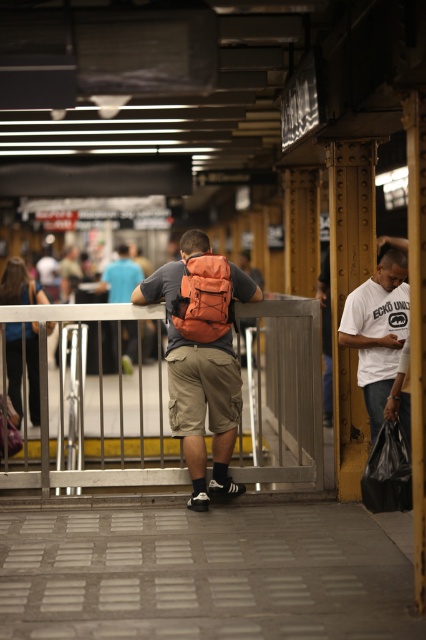
Is white cotton shirt at right positioned in front of matte orange backpack at center?

Yes, white cotton shirt at right is closer to the viewer.

Between point (348, 344) and point (104, 285), which one is positioned in front?

Positioned in front is point (348, 344).

Where is `white cotton shirt at right`? white cotton shirt at right is located at coordinates (377, 330).

Does metallic silver rail at center have a lesser width compared to white cotton shirt at right?

Yes.

Does metallic silver rail at center appear under white cotton shirt at right?

Correct, metallic silver rail at center is located below white cotton shirt at right.

Who is more forward, (x=97, y=465) or (x=402, y=328)?

Point (x=402, y=328) is in front.

At what (x,y) coordinates should I click in order to perform the action: click on metallic silver rail at center. Please return your answer as a coordinate pair (x, y). The width and height of the screenshot is (426, 640). Looking at the image, I should click on (98, 417).

This screenshot has width=426, height=640. In order to click on metallic silver rail at center in this screenshot , I will do `click(98, 417)`.

Between metallic silver rail at center and khaki cargo shorts at center, which one appears on the right side from the viewer's perspective?

khaki cargo shorts at center is more to the right.

Between point (115, 385) and point (180, 353), which one is positioned in front?

Positioned in front is point (180, 353).

Identify the location of metallic silver rail at center. The height and width of the screenshot is (640, 426). (98, 417).